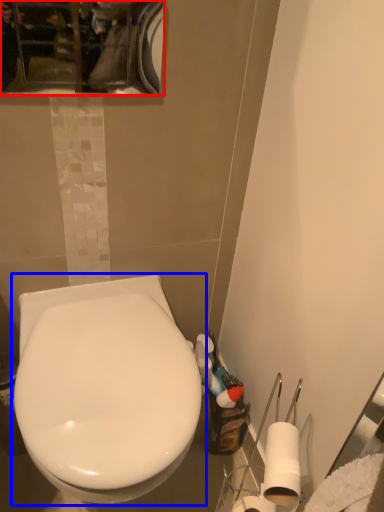
Question: Which point is further to the camera, mirror (highlighted by a red box) or toilet (highlighted by a blue box)?

Choices:
 (A) mirror
 (B) toilet

Answer: (A)